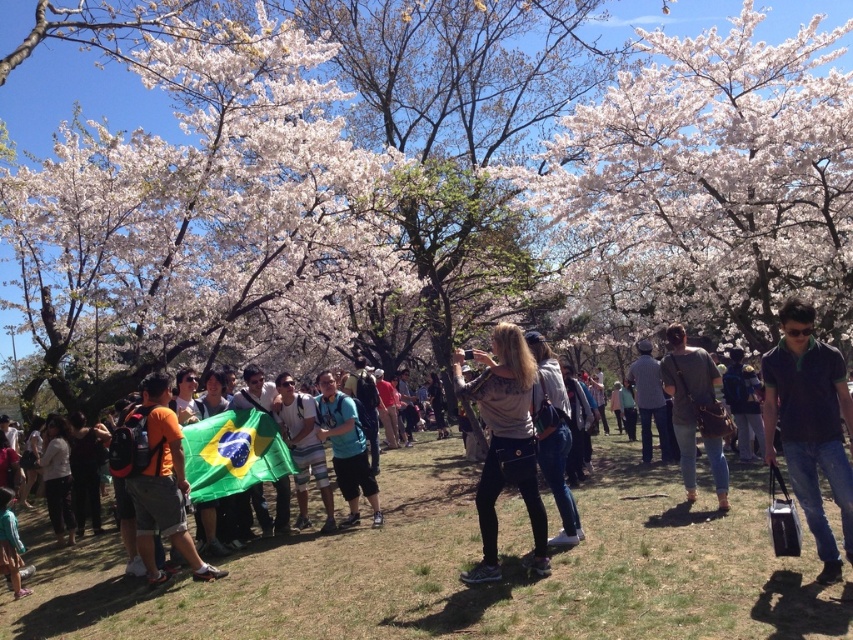
Who is lower down, white blossoms at center or dark gray shirt at center?

Positioned lower is dark gray shirt at center.

Can you confirm if white blossoms at center is taller than dark gray shirt at center?

Correct, white blossoms at center is much taller as dark gray shirt at center.

Is point (746, 147) behind point (642, 435)?

Yes, it is behind point (642, 435).

At what (x,y) coordinates should I click in order to perform the action: click on white blossoms at center. Please return your answer as a coordinate pair (x, y). The width and height of the screenshot is (853, 640). Looking at the image, I should click on (718, 173).

Between white blossoms at center and green fabric flag at center, which one is positioned lower?

green fabric flag at center is below.

Between white blossoms at center and green fabric flag at center, which one has more height?

white blossoms at center is taller.

Is point (759, 92) closer to camera compared to point (225, 477)?

No, (759, 92) is behind (225, 477).

Locate an element on the screen. The width and height of the screenshot is (853, 640). white blossoms at center is located at coordinates (718, 173).

Does green fabric flag at center appear under brown leather bag at center?

Correct, green fabric flag at center is located below brown leather bag at center.

The width and height of the screenshot is (853, 640). What do you see at coordinates (231, 452) in the screenshot?
I see `green fabric flag at center` at bounding box center [231, 452].

The image size is (853, 640). I want to click on green fabric flag at center, so click(x=231, y=452).